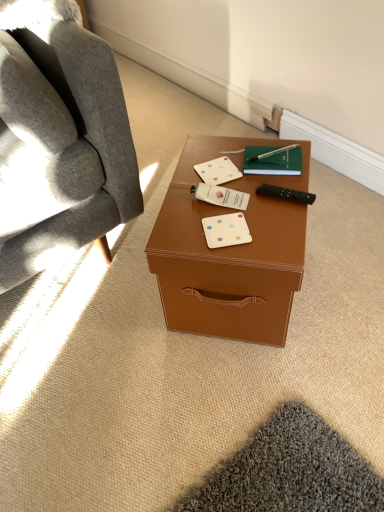
Locate an element on the screen. Image resolution: width=384 pixels, height=512 pixels. space that is in front of green matte notebook at center is located at coordinates (273, 202).